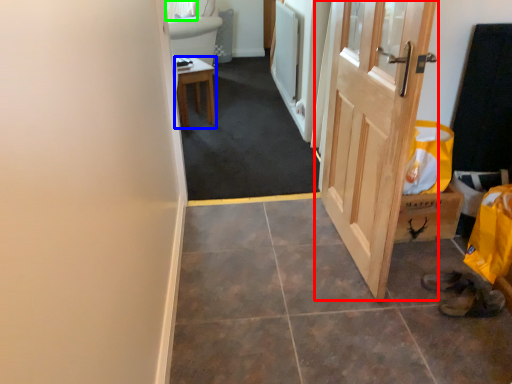
Question: Considering the real-world distances, which object is closest to door (highlighted by a red box)? furniture (highlighted by a blue box) or curtain (highlighted by a green box).

Choices:
 (A) furniture
 (B) curtain

Answer: (A)